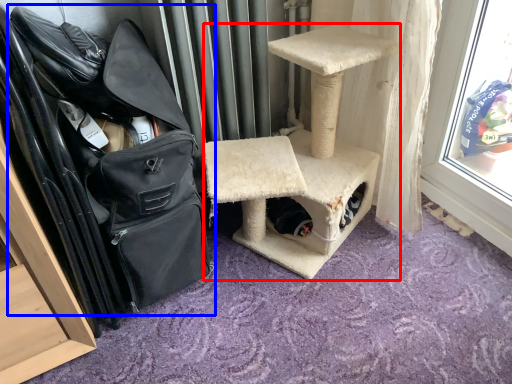
Question: Which point is further to the camera, furniture (highlighted by a red box) or shoulder bag (highlighted by a blue box)?

Choices:
 (A) furniture
 (B) shoulder bag

Answer: (A)